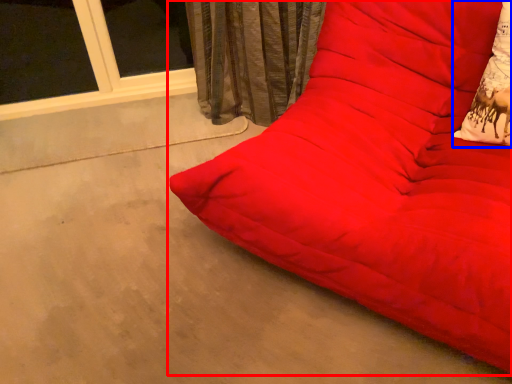
Question: Which object appears closest to the camera in this image, studio couch (highlighted by a red box) or throw pillow (highlighted by a blue box)?

Choices:
 (A) studio couch
 (B) throw pillow

Answer: (A)